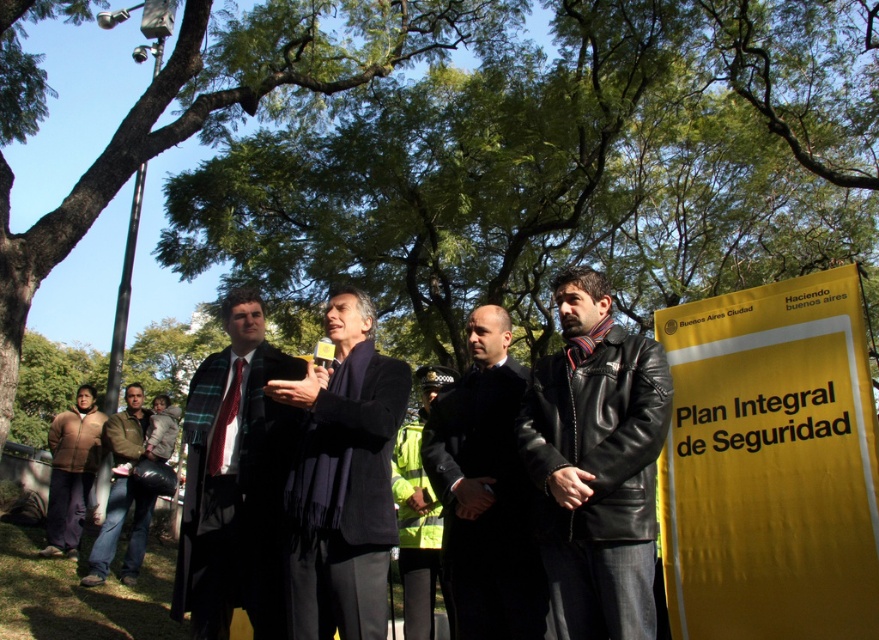
You are an event planner assessing the visibility of attendees at the outdoor event. Considering the green leafy tree at upper center and the black leather jacket at center, which object is bigger in the image?

The green leafy tree at upper center is larger in size compared to the black leather jacket at center, so the tree is bigger.

You are attending an outdoor event under clear blue skies with lush green trees around. There are two points marked in the image. The first point is at coordinate point [510,547] and the second point is at coordinate point [98,428]. From your perspective at the event, which point is closer to you?

Point [510,547] is in front of point [98,428], so the first point is closer to you.

You are a photographer at the event and want to take a photo of the plaid wool scarf at center and the brown leather jacket at lower left. Which object will appear larger in your photo?

The plaid wool scarf at center will appear larger in the photo because it is closer to the viewer than the brown leather jacket at lower left.